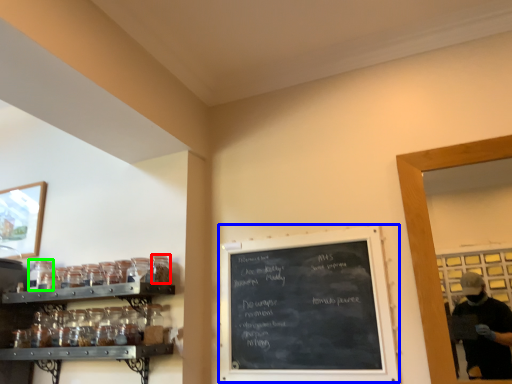
Question: Based on their relative distances, which object is farther from glass jar (highlighted by a red box)? Choose from bulletin board (highlighted by a blue box) and glass jar (highlighted by a green box).

Choices:
 (A) bulletin board
 (B) glass jar

Answer: (A)